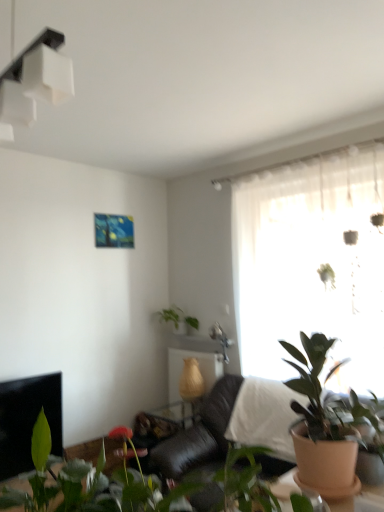
Question: Is translucent glass window at center bigger than white matte light fixture at upper left?

Choices:
 (A) no
 (B) yes

Answer: (B)

Question: Is translucent glass window at center at the left side of white matte light fixture at upper left?

Choices:
 (A) no
 (B) yes

Answer: (A)

Question: Is translucent glass window at center wider than white matte light fixture at upper left?

Choices:
 (A) no
 (B) yes

Answer: (B)

Question: From the image's perspective, is translucent glass window at center over white matte light fixture at upper left?

Choices:
 (A) yes
 (B) no

Answer: (B)

Question: Is translucent glass window at center to the right of white matte light fixture at upper left from the viewer's perspective?

Choices:
 (A) no
 (B) yes

Answer: (B)

Question: Considering the positions of white glossy shelf at center and white matte light fixture at upper left in the image, is white glossy shelf at center bigger or smaller than white matte light fixture at upper left?

Choices:
 (A) big
 (B) small

Answer: (B)

Question: In the image, is white glossy shelf at center on the left side or the right side of white matte light fixture at upper left?

Choices:
 (A) left
 (B) right

Answer: (B)

Question: Considering the positions of point (205, 352) and point (61, 39), is point (205, 352) closer or farther from the camera than point (61, 39)?

Choices:
 (A) closer
 (B) farther

Answer: (B)

Question: Relative to white matte light fixture at upper left, is white glossy shelf at center in front or behind?

Choices:
 (A) behind
 (B) front

Answer: (A)

Question: Looking at their shapes, would you say green matte plant at lower left, which is counted as the first houseplant, starting from the front, is wider or thinner than translucent glass window at center?

Choices:
 (A) wide
 (B) thin

Answer: (A)

Question: From the image's perspective, relative to translucent glass window at center, is green matte plant at lower left, the third houseplant from the back, above or below?

Choices:
 (A) above
 (B) below

Answer: (B)

Question: Is point (94, 509) positioned closer to the camera than point (370, 180)?

Choices:
 (A) closer
 (B) farther

Answer: (A)

Question: From their relative heights in the image, would you say green matte plant at lower left, the third houseplant from the back, is taller or shorter than translucent glass window at center?

Choices:
 (A) tall
 (B) short

Answer: (B)

Question: Is white matte light fixture at upper left bigger or smaller than green matte plant at upper center, which appears as the third houseplant when viewed from the front?

Choices:
 (A) big
 (B) small

Answer: (A)

Question: From a real-world perspective, is white matte light fixture at upper left physically located above or below green matte plant at upper center, which appears as the third houseplant when viewed from the front?

Choices:
 (A) below
 (B) above

Answer: (B)